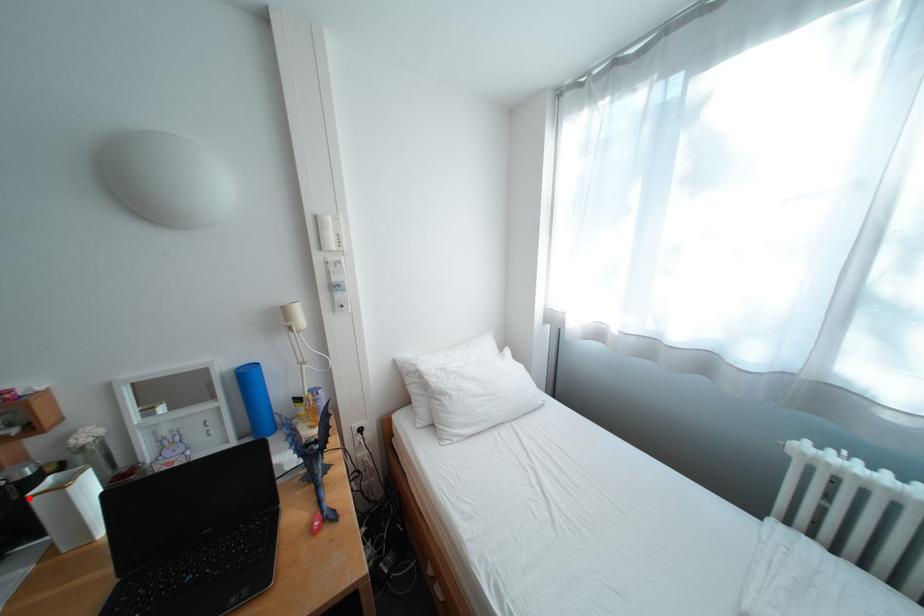
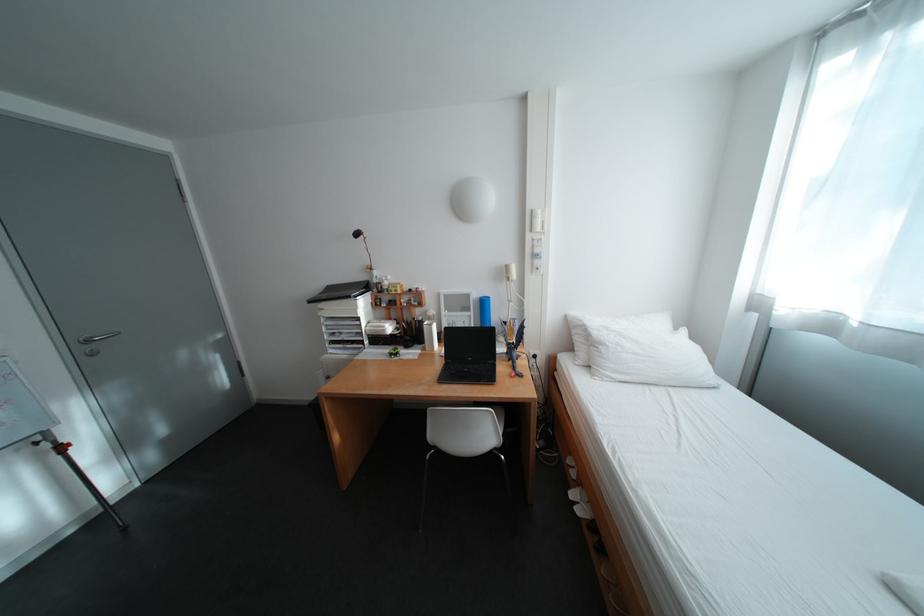
In the second image, find the point that corresponds to the highlighted location in the first image.

(430, 326)